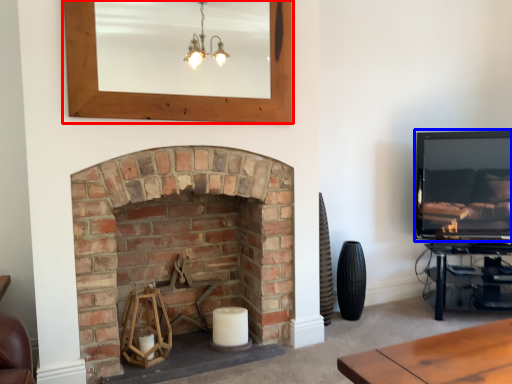
Question: Which of the following is the closest to the observer, picture frame (highlighted by a red box) or television (highlighted by a blue box)?

Choices:
 (A) picture frame
 (B) television

Answer: (A)